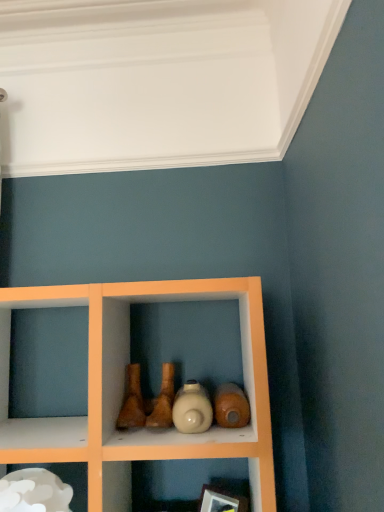
Question: Relative to wooden picture frame at lower center, is matte beige bottle at center in front or behind?

Choices:
 (A) behind
 (B) front

Answer: (B)

Question: In the image, is matte beige bottle at center on the left side or the right side of wooden picture frame at lower center?

Choices:
 (A) right
 (B) left

Answer: (B)

Question: Which object is positioned closest to the white glossy cloud at lower left?

Choices:
 (A) wooden picture frame at lower center
 (B) matte beige bottle at center

Answer: (B)

Question: Which of these objects is positioned closest to the white glossy cloud at lower left?

Choices:
 (A) wooden picture frame at lower center
 (B) matte beige bottle at center

Answer: (B)